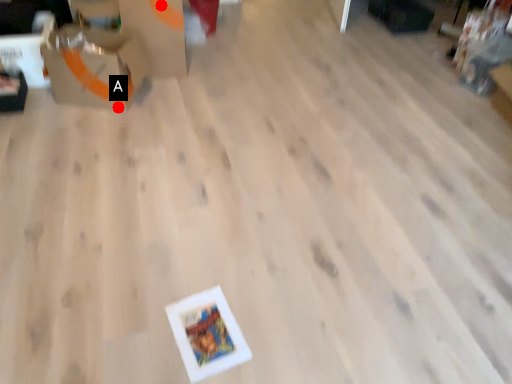
Question: Two points are circled on the image, labeled by A and B beside each circle. Which of the following is the closest to the observer?

Choices:
 (A) A is closer
 (B) B is closer

Answer: (A)